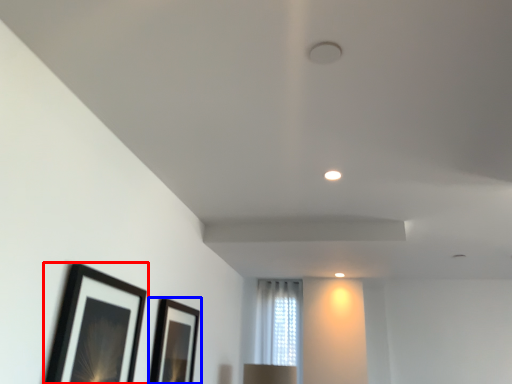
Question: Which point is further to the camera, picture frame (highlighted by a red box) or picture frame (highlighted by a blue box)?

Choices:
 (A) picture frame
 (B) picture frame

Answer: (B)